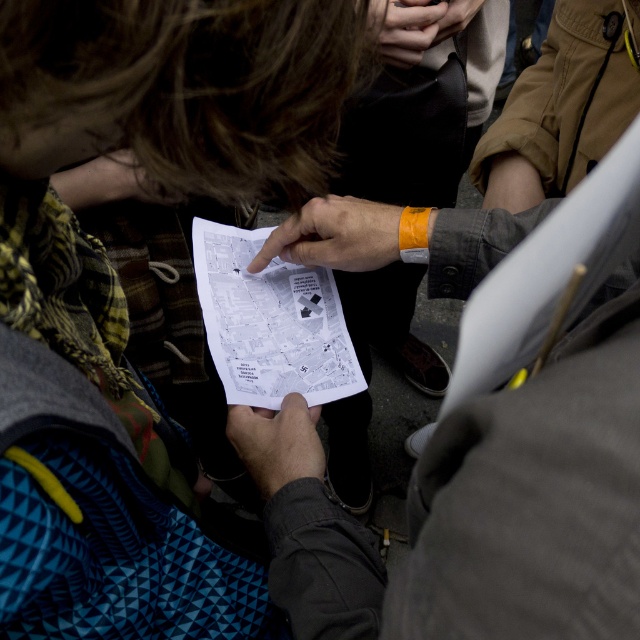
Question: Can you confirm if white paper at center is positioned above orange fabric wristband at center?

Choices:
 (A) yes
 (B) no

Answer: (B)

Question: Does white paper at center appear on the right side of smooth skin hand at upper center?

Choices:
 (A) yes
 (B) no

Answer: (B)

Question: Estimate the real-world distances between objects in this image. Which object is farther from the dark brown leather hand at center?

Choices:
 (A) white paper at center
 (B) plaid fabric scarf at upper left
 (C) orange fabric wristband at center

Answer: (C)

Question: Is smooth black paper at center to the left of dark brown leather hand at center from the viewer's perspective?

Choices:
 (A) no
 (B) yes

Answer: (A)

Question: Which object appears closest to the camera in this image?

Choices:
 (A) plaid fabric scarf at upper left
 (B) dark brown leather hand at center

Answer: (A)

Question: Estimate the real-world distances between objects in this image. Which object is farther from the smooth skin hand at upper center?

Choices:
 (A) white paper at center
 (B) plaid fabric scarf at upper left
 (C) orange fabric wristband at center

Answer: (B)